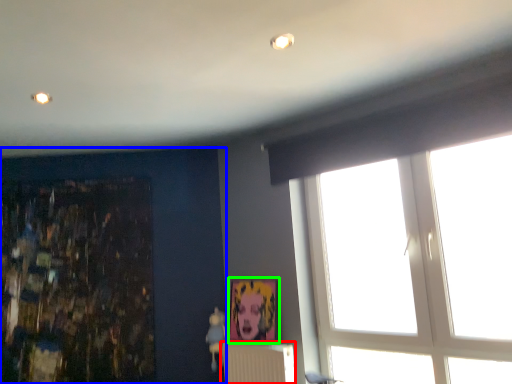
Question: Which object is positioned farthest from radiator (highlighted by a red box)? Select from backdrop (highlighted by a blue box) and picture frame (highlighted by a green box).

Choices:
 (A) backdrop
 (B) picture frame

Answer: (A)